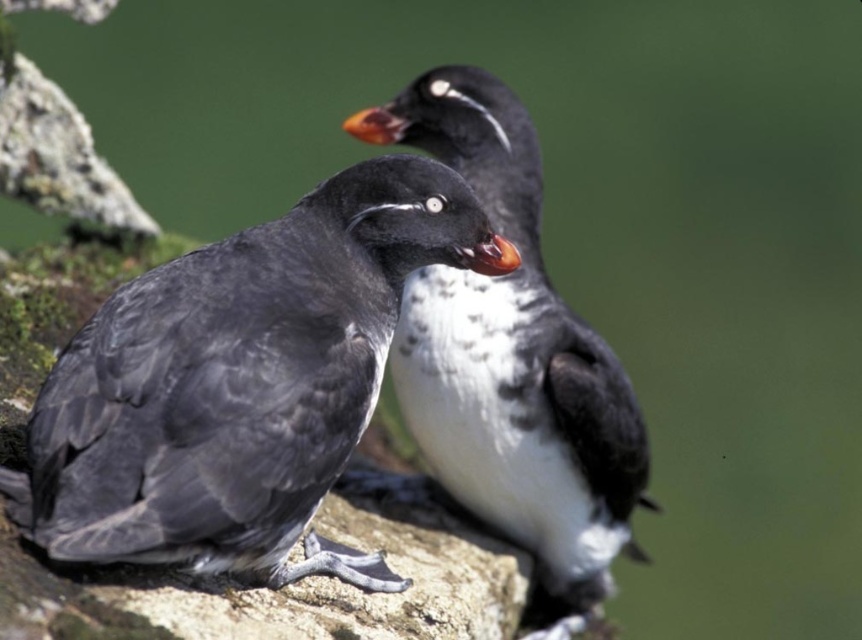
You are a birdwatcher observing two birds in the image. You see a matte black bird at left and a black feathered bird at center. Which of these two birds is positioned more to the left?

The matte black bird at left is positioned more to the left than the black feathered bird at center.

You are a birdwatcher trying to identify two puffins in the image. The scene shows a matte black bird at left and a black feathered bird at center. Which of these two birds is narrower in size?

The matte black bird at left has a lesser width compared to the black feathered bird at center, so the matte black bird at left is narrower in size.